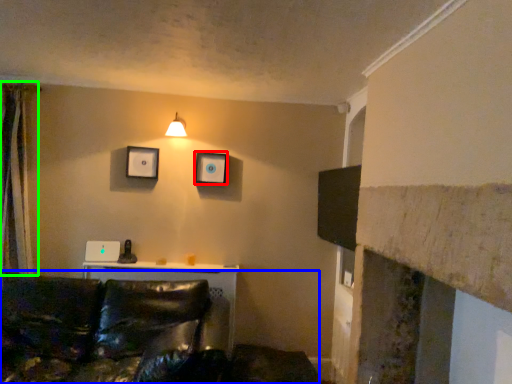
Question: Considering the real-world distances, which object is farthest from picture frame (highlighted by a red box)? studio couch (highlighted by a blue box) or curtain (highlighted by a green box)?

Choices:
 (A) studio couch
 (B) curtain

Answer: (B)